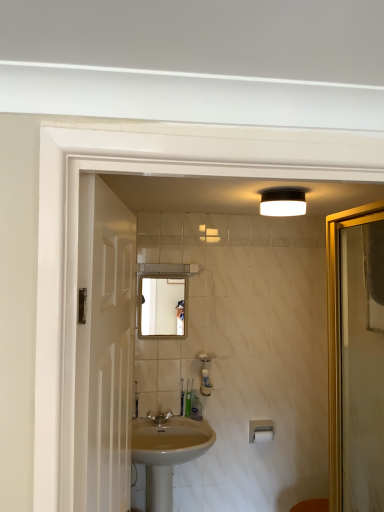
What is the approximate height of matte glass mirror at center?

16.77 inches.

The height and width of the screenshot is (512, 384). What are the coordinates of `white plastic towel bar at lower center` in the screenshot? It's located at (260, 430).

The height and width of the screenshot is (512, 384). What are the coordinates of `translucent plastic soap dispenser at center` in the screenshot? It's located at (205, 372).

What do you see at coordinates (263, 435) in the screenshot?
I see `white matte toilet paper at lower center` at bounding box center [263, 435].

The width and height of the screenshot is (384, 512). What are the coordinates of `beige ceramic sink at center` in the screenshot? It's located at tap(167, 453).

Considering the relative sizes of white matte toilet paper at lower center and matte silver faucet at center in the image provided, is white matte toilet paper at lower center bigger than matte silver faucet at center?

Incorrect, white matte toilet paper at lower center is not larger than matte silver faucet at center.

Which object is positioned more to the left, white matte toilet paper at lower center or matte silver faucet at center?

matte silver faucet at center is more to the left.

Between white matte toilet paper at lower center and matte silver faucet at center, which one has smaller width?

With smaller width is white matte toilet paper at lower center.

From a real-world perspective, who is located higher, white matte toilet paper at lower center or matte silver faucet at center?

matte silver faucet at center.

Considering the relative sizes of white glossy screen door at left and beige ceramic sink at center in the image provided, is white glossy screen door at left shorter than beige ceramic sink at center?

In fact, white glossy screen door at left may be taller than beige ceramic sink at center.

Between white glossy screen door at left and beige ceramic sink at center, which one appears on the left side from the viewer's perspective?

white glossy screen door at left.

Is matte silver faucet at center behind beige ceramic sink at center?

Yes, the depth of matte silver faucet at center is greater than that of beige ceramic sink at center.

Is matte silver faucet at center in contact with beige ceramic sink at center?

No, matte silver faucet at center is not beside beige ceramic sink at center.

Which is behind, point (147, 416) or point (146, 440)?

Positioned behind is point (147, 416).

From the image's perspective, is matte silver faucet at center located beneath beige ceramic sink at center?

No.

From a real-world perspective, between white glossy screen door at left and matte silver faucet at center, who is vertically lower?

matte silver faucet at center, from a real-world perspective.

What's the angular difference between white glossy screen door at left and matte silver faucet at center's facing directions?

white glossy screen door at left and matte silver faucet at center are facing 81.9 degrees away from each other.

Are white glossy screen door at left and matte silver faucet at center making contact?

No, white glossy screen door at left is not with matte silver faucet at center.

Is white glossy screen door at left further to the viewer compared to matte silver faucet at center?

No, it is in front of matte silver faucet at center.

Considering the positions of point (196, 396) and point (210, 385), is point (196, 396) closer or farther from the camera than point (210, 385)?

Point (196, 396).

Which of these two, translucent plastic toothbrush at center, which appears as the third toiletry when viewed from the left, or translucent plastic soap dispenser at center, stands taller?

translucent plastic toothbrush at center, which appears as the third toiletry when viewed from the left.

From the image's perspective, is translucent plastic toothbrush at center, which appears as the third toiletry when viewed from the left, located above or below translucent plastic soap dispenser at center?

translucent plastic toothbrush at center, which appears as the third toiletry when viewed from the left, is below translucent plastic soap dispenser at center.

Is translucent plastic toothbrush at center, which is the first toiletry in right-to-left order, surrounding translucent plastic soap dispenser at center?

No, translucent plastic soap dispenser at center is not inside translucent plastic toothbrush at center, which is the first toiletry in right-to-left order.

Which object is closer to the camera, translucent plastic soap dispenser at center or white glossy screen door at left?

white glossy screen door at left is closer to the camera.

Can you confirm if translucent plastic soap dispenser at center is wider than white glossy screen door at left?

Yes, translucent plastic soap dispenser at center is wider than white glossy screen door at left.

Considering the relative sizes of translucent plastic soap dispenser at center and white glossy screen door at left in the image provided, is translucent plastic soap dispenser at center shorter than white glossy screen door at left?

Yes, translucent plastic soap dispenser at center is shorter than white glossy screen door at left.

Does translucent plastic soap dispenser at center have a larger size compared to white glossy screen door at left?

No, translucent plastic soap dispenser at center is not bigger than white glossy screen door at left.

Which is in front, point (184, 394) or point (196, 400)?

Point (184, 394)

Who is taller, green plastic toothbrush at center, the third toiletry when ordered from right to left, or translucent plastic toothbrush at center, which is the first toiletry in right-to-left order?

green plastic toothbrush at center, the third toiletry when ordered from right to left, is taller.

Is translucent plastic toothbrush at center, which is the first toiletry in right-to-left order, located within green plastic toothbrush at center, the third toiletry when ordered from right to left?

No, translucent plastic toothbrush at center, which is the first toiletry in right-to-left order, is located outside of green plastic toothbrush at center, the third toiletry when ordered from right to left.

Considering the relative sizes of green plastic toothbrush at center, the 1th toiletry from the left, and translucent plastic toothbrush at center, which appears as the third toiletry when viewed from the left, in the image provided, is green plastic toothbrush at center, the 1th toiletry from the left, thinner than translucent plastic toothbrush at center, which appears as the third toiletry when viewed from the left,?

Yes, green plastic toothbrush at center, the 1th toiletry from the left, is thinner than translucent plastic toothbrush at center, which appears as the third toiletry when viewed from the left.

The width and height of the screenshot is (384, 512). Find the location of `tap above the white matte toilet paper at lower center (from a real-world perspective)`. tap above the white matte toilet paper at lower center (from a real-world perspective) is located at coordinates (159, 417).

Find the location of a particular element. The height and width of the screenshot is (512, 384). screen door lying on the left of beige ceramic sink at center is located at coordinates (104, 350).

Considering their positions, is translucent plastic toothbrush at center, which is the first toiletry in right-to-left order, positioned further to white plastic towel bar at lower center than white glossy screen door at left?

The object further to white plastic towel bar at lower center is white glossy screen door at left.

From the image, which object appears to be nearer to matte silver faucet at center, translucent plastic toothbrush at center, which appears as the third toiletry when viewed from the left, or green plastic toothbrush at center, the 1th toiletry from the left?

The object closer to matte silver faucet at center is green plastic toothbrush at center, the 1th toiletry from the left.

Considering their positions, is white matte toilet paper at lower center positioned closer to white glossy screen door at left than beige ceramic sink at center?

beige ceramic sink at center is positioned closer to the anchor white glossy screen door at left.

Which object lies further to the anchor point translucent plastic soap dispenser at center, beige ceramic sink at center or translucent plastic toothbrush at center, which appears as the third toiletry when viewed from the left?

Among the two, beige ceramic sink at center is located further to translucent plastic soap dispenser at center.

From the image, which object appears to be farther from beige ceramic sink at center, white matte toilet paper at lower center or translucent plastic toothbrush at lower center, positioned as the 2th toiletry in left-to-right order?

Based on the image, white matte toilet paper at lower center appears to be further to beige ceramic sink at center.

When comparing their distances from translucent plastic toothbrush at lower center, positioned as the second toiletry in right-to-left order, does white matte toilet paper at lower center or white matte light fixture at upper center seem closer?

A: white matte toilet paper at lower center is positioned closer to the anchor translucent plastic toothbrush at lower center, positioned as the second toiletry in right-to-left order.

Looking at the image, which one is located further to green plastic toothbrush at center, the third toiletry when ordered from right to left, translucent plastic soap dispenser at center or white plastic towel bar at lower center?

white plastic towel bar at lower center.

Estimate the real-world distances between objects in this image. Which object is further from white matte light fixture at upper center, translucent plastic toothbrush at center, which is the first toiletry in right-to-left order, or white matte toilet paper at lower center?

white matte toilet paper at lower center is positioned further to the anchor white matte light fixture at upper center.

Find the location of a particular element. soap dispenser positioned between white glossy screen door at left and translucent plastic toothbrush at lower center, positioned as the second toiletry in right-to-left order, from near to far is located at coordinates (205, 372).

This screenshot has width=384, height=512. Find the location of `soap dispenser located between translucent plastic toothbrush at center, which appears as the third toiletry when viewed from the left, and white plastic towel bar at lower center in the left-right direction`. soap dispenser located between translucent plastic toothbrush at center, which appears as the third toiletry when viewed from the left, and white plastic towel bar at lower center in the left-right direction is located at coordinates (205, 372).

Identify the location of toiletry between white matte light fixture at upper center and green plastic toothbrush at center, the third toiletry when ordered from right to left, in the up-down direction. coord(188,398).

At what (x,y) coordinates should I click in order to perform the action: click on soap dispenser between beige ceramic sink at center and white plastic towel bar at lower center from front to back. Please return your answer as a coordinate pair (x, y). The width and height of the screenshot is (384, 512). Looking at the image, I should click on (205, 372).